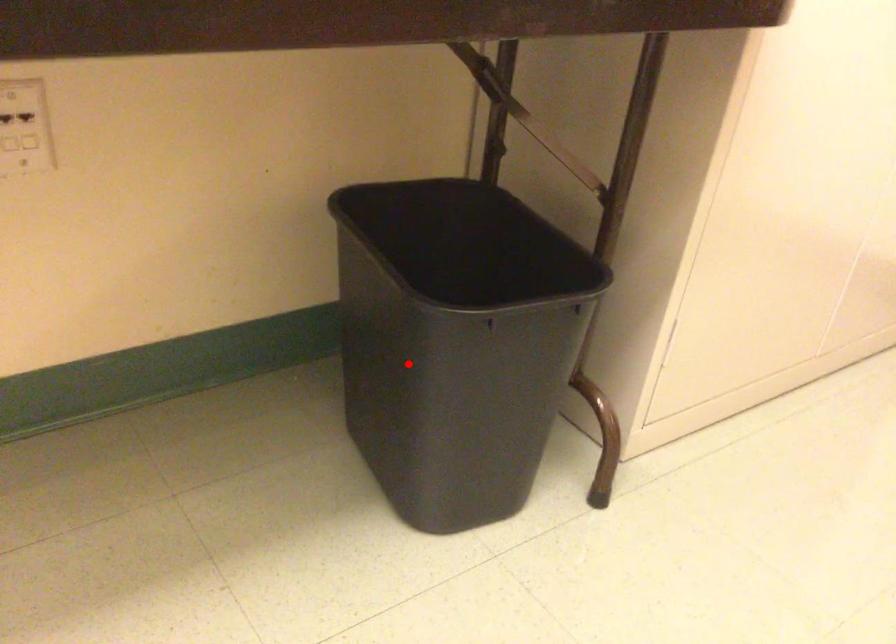
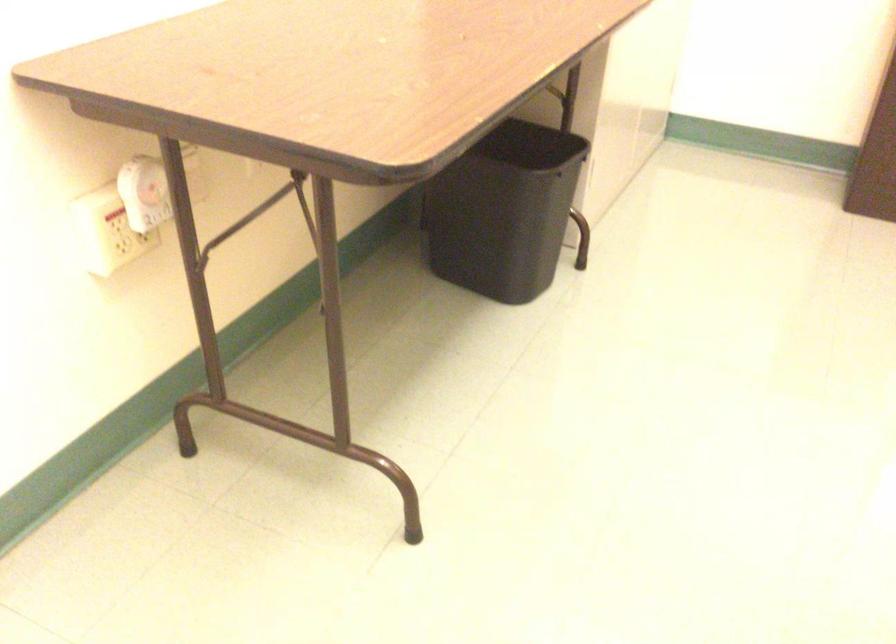
Question: A red point is marked in image1. In image2, is the corresponding 3D point closer to the camera or farther? Reply with the corresponding letter.

Choices:
 (A) The corresponding 3D point is closer.
 (B) The corresponding 3D point is farther.

Answer: (B)